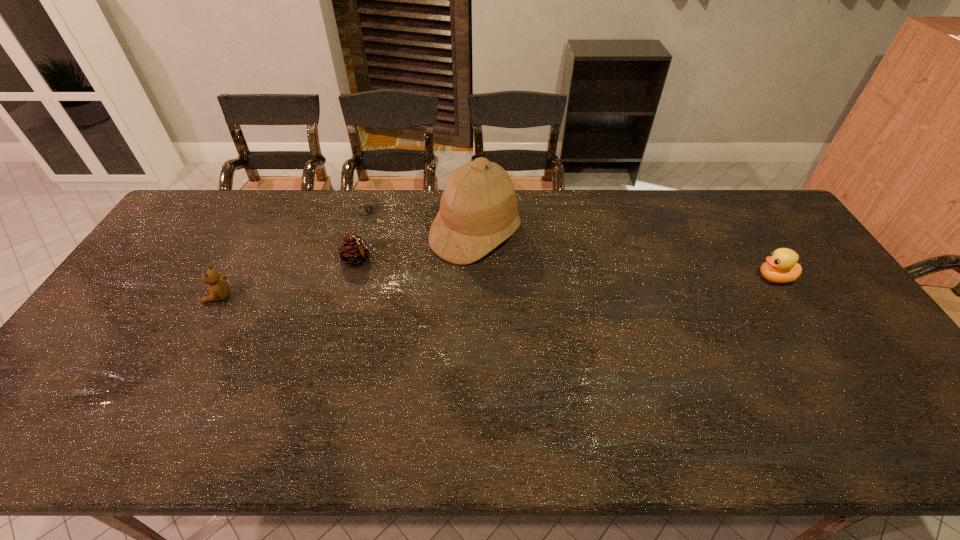
Identify the location of vacant region located on the front-facing side of the hat. This screenshot has height=540, width=960. (568, 285).

Find the location of a particular element. This screenshot has width=960, height=540. watch present at the far edge is located at coordinates (370, 208).

This screenshot has width=960, height=540. What are the coordinates of `hat present at the far edge` in the screenshot? It's located at pos(478,211).

At what (x,y) coordinates should I click in order to perform the action: click on object present at the right edge. Please return your answer as a coordinate pair (x, y). Looking at the image, I should click on (781, 267).

Locate an element on the screen. vacant region at the far edge of the desktop is located at coordinates (668, 230).

You are a GUI agent. You are given a task and a screenshot of the screen. Output one action in this format:
    pyautogui.click(x=<x>, y=<y>)
    Task: Click on the free space at the near edge of the desktop
    The image size is (960, 540).
    Given the screenshot: What is the action you would take?
    pyautogui.click(x=636, y=375)

Image resolution: width=960 pixels, height=540 pixels. In the image, there is a desktop. In order to click on vacant space at the far right corner in this screenshot , I will do `click(768, 230)`.

Where is `unoccupied area between the pinecone and the fourth object from left to right`? unoccupied area between the pinecone and the fourth object from left to right is located at coordinates (417, 247).

Find the location of a particular element. The width and height of the screenshot is (960, 540). free space that is in between the duckling and the shortest object is located at coordinates (571, 244).

This screenshot has width=960, height=540. Find the location of `empty space between the rightmost object and the shortest object`. empty space between the rightmost object and the shortest object is located at coordinates (571, 244).